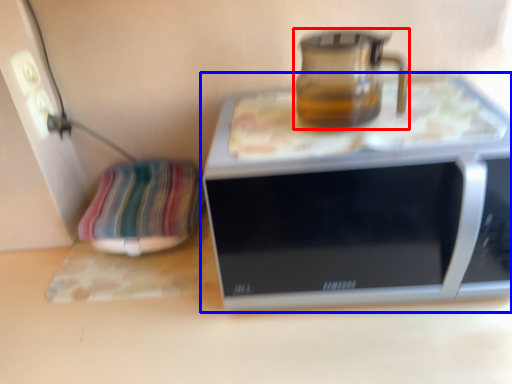
Question: Which of the following is the closest to the observer, jug (highlighted by a red box) or microwave oven (highlighted by a blue box)?

Choices:
 (A) jug
 (B) microwave oven

Answer: (B)